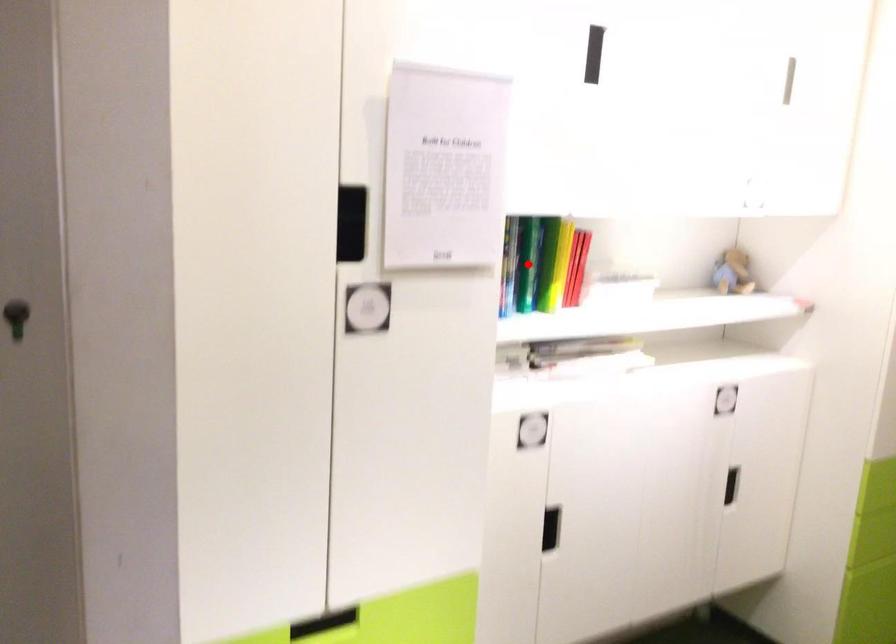
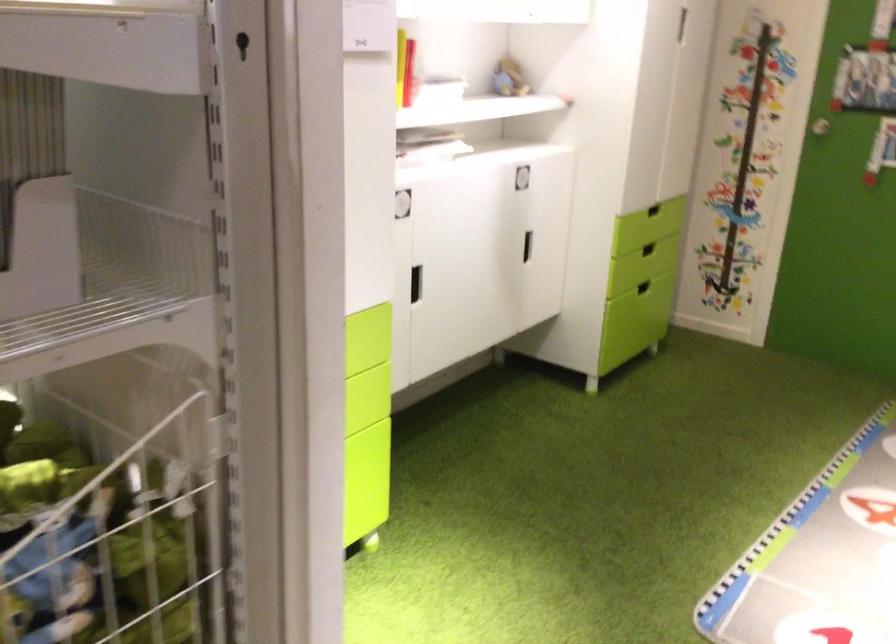
Question: I am providing you with two images of the same scene from different viewpoints. A red point is marked on the first image. Can you still see the location of the red point in image 2?

Choices:
 (A) Yes
 (B) No

Answer: (B)